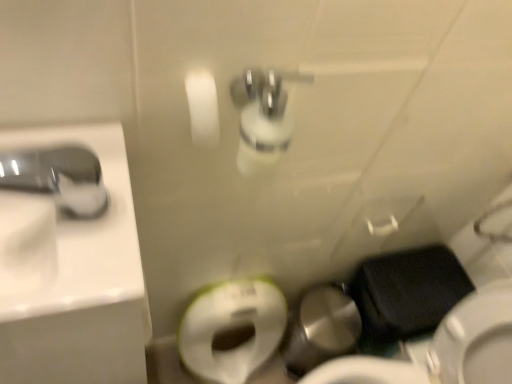
Question: From the image's perspective, is white glossy sink at left on top of black matte wallet at lower right?

Choices:
 (A) yes
 (B) no

Answer: (A)

Question: Is white glossy sink at left smaller than black matte wallet at lower right?

Choices:
 (A) yes
 (B) no

Answer: (A)

Question: Is white glossy sink at left looking in the opposite direction of black matte wallet at lower right?

Choices:
 (A) yes
 (B) no

Answer: (B)

Question: Can you confirm if white glossy sink at left is wider than black matte wallet at lower right?

Choices:
 (A) yes
 (B) no

Answer: (B)

Question: Is white glossy sink at left far away from black matte wallet at lower right?

Choices:
 (A) yes
 (B) no

Answer: (B)

Question: Would you say white glossy sink at left contains black matte wallet at lower right?

Choices:
 (A) no
 (B) yes

Answer: (A)

Question: Considering the relative sizes of white glossy sink at left and satin nickel faucet at upper left in the image provided, is white glossy sink at left shorter than satin nickel faucet at upper left?

Choices:
 (A) no
 (B) yes

Answer: (A)

Question: Is white glossy sink at left further to the viewer compared to satin nickel faucet at upper left?

Choices:
 (A) yes
 (B) no

Answer: (A)

Question: From a real-world perspective, is white glossy sink at left physically below satin nickel faucet at upper left?

Choices:
 (A) no
 (B) yes

Answer: (B)

Question: Can you confirm if white glossy sink at left is bigger than satin nickel faucet at upper left?

Choices:
 (A) yes
 (B) no

Answer: (A)

Question: Can you confirm if white glossy sink at left is positioned to the left of satin nickel faucet at upper left?

Choices:
 (A) no
 (B) yes

Answer: (A)

Question: Is white glossy sink at left looking in the opposite direction of satin nickel faucet at upper left?

Choices:
 (A) yes
 (B) no

Answer: (B)

Question: Is satin nickel faucet at upper left bigger than white glossy sink at left?

Choices:
 (A) no
 (B) yes

Answer: (A)